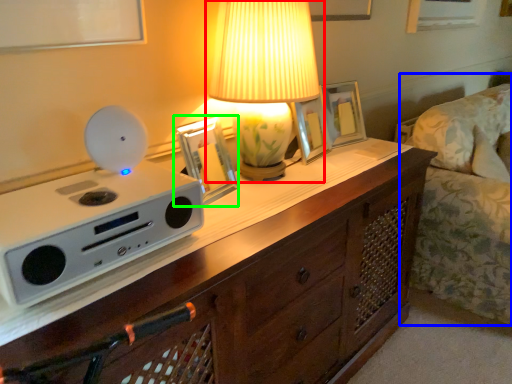
Question: Based on their relative distances, which object is nearer to lamp (highlighted by a red box)? Choose from couch (highlighted by a blue box) and picture frame (highlighted by a green box).

Choices:
 (A) couch
 (B) picture frame

Answer: (B)